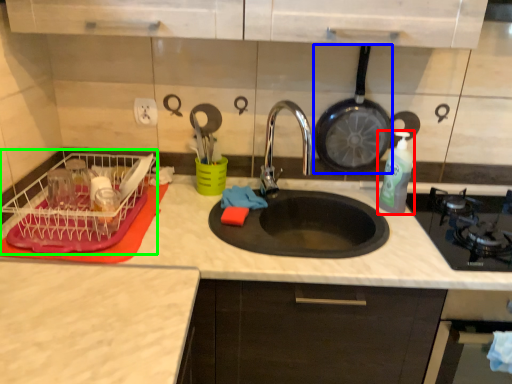
Question: Considering the real-world distances, which object is farthest from bottle (highlighted by a red box)? frying pan (highlighted by a blue box) or dish washer (highlighted by a green box)?

Choices:
 (A) frying pan
 (B) dish washer

Answer: (B)